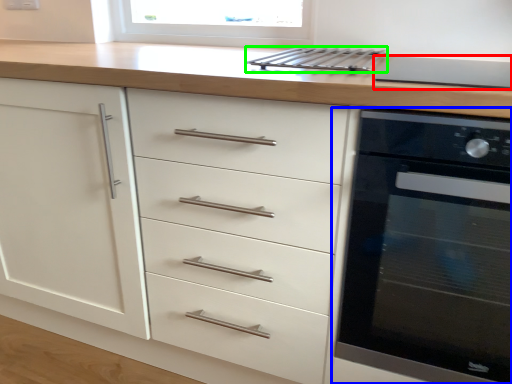
Question: Which object is the farthest from appliance (highlighted by a red box)? Choose among these: home appliance (highlighted by a blue box) or kitchen appliance (highlighted by a green box).

Choices:
 (A) home appliance
 (B) kitchen appliance

Answer: (A)